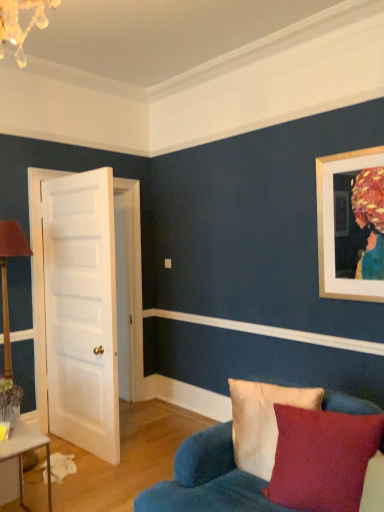
Question: Is white smooth door at left surrounded by velvet beige pillow at lower right, the 2th pillow in the front-to-back sequence?

Choices:
 (A) no
 (B) yes

Answer: (A)

Question: From a real-world perspective, does velvet beige pillow at lower right, the 2th pillow in the front-to-back sequence, stand above white smooth door at left?

Choices:
 (A) yes
 (B) no

Answer: (B)

Question: Is velvet beige pillow at lower right, the 2th pillow in the front-to-back sequence, to the right of white smooth door at left from the viewer's perspective?

Choices:
 (A) yes
 (B) no

Answer: (A)

Question: Is velvet beige pillow at lower right, marked as the first pillow in a back-to-front arrangement, thinner than white smooth door at left?

Choices:
 (A) no
 (B) yes

Answer: (A)

Question: Is velvet beige pillow at lower right, the 2th pillow in the front-to-back sequence, facing towards white smooth door at left?

Choices:
 (A) no
 (B) yes

Answer: (A)

Question: In terms of width, does velvet beige pillow at lower right, marked as the first pillow in a back-to-front arrangement, look wider or thinner when compared to velvet blue couch at lower right?

Choices:
 (A) thin
 (B) wide

Answer: (A)

Question: From a real-world perspective, relative to velvet blue couch at lower right, is velvet beige pillow at lower right, marked as the first pillow in a back-to-front arrangement, vertically above or below?

Choices:
 (A) above
 (B) below

Answer: (A)

Question: Is velvet beige pillow at lower right, the 2th pillow in the front-to-back sequence, bigger or smaller than velvet blue couch at lower right?

Choices:
 (A) big
 (B) small

Answer: (B)

Question: Is velvet beige pillow at lower right, marked as the first pillow in a back-to-front arrangement, in front of or behind velvet blue couch at lower right in the image?

Choices:
 (A) front
 (B) behind

Answer: (B)

Question: Which is correct: white glossy table at lower left is inside white smooth molding at center, or outside of it?

Choices:
 (A) outside
 (B) inside

Answer: (A)

Question: From a real-world perspective, relative to white smooth molding at center, is white glossy table at lower left vertically above or below?

Choices:
 (A) above
 (B) below

Answer: (B)

Question: In terms of height, does white glossy table at lower left look taller or shorter compared to white smooth molding at center?

Choices:
 (A) short
 (B) tall

Answer: (B)

Question: From the image's perspective, is white glossy table at lower left located above or below white smooth molding at center?

Choices:
 (A) above
 (B) below

Answer: (B)

Question: Would you say velvety red pillow at lower right, the 2th pillow when ordered from back to front, is inside or outside white glossy table at lower left?

Choices:
 (A) inside
 (B) outside

Answer: (B)

Question: Considering the positions of velvety red pillow at lower right, the first pillow in the front-to-back sequence, and white glossy table at lower left in the image, is velvety red pillow at lower right, the first pillow in the front-to-back sequence, wider or thinner than white glossy table at lower left?

Choices:
 (A) wide
 (B) thin

Answer: (B)